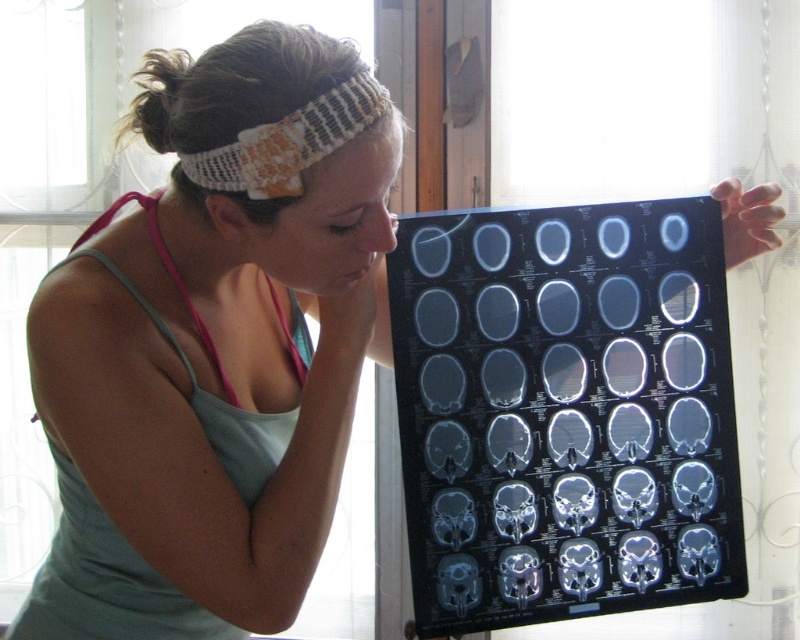
Question: Is white knitted headscarf at upper center to the right of white knitted headband at upper center from the viewer's perspective?

Choices:
 (A) no
 (B) yes

Answer: (A)

Question: Which of the following is the farthest from the observer?

Choices:
 (A) white knitted headscarf at upper center
 (B) white knitted headband at upper center

Answer: (B)

Question: Among these objects, which one is nearest to the camera?

Choices:
 (A) white knitted headscarf at upper center
 (B) white knitted headband at upper center

Answer: (A)

Question: Does white knitted headscarf at upper center have a smaller size compared to white knitted headband at upper center?

Choices:
 (A) no
 (B) yes

Answer: (A)

Question: Which object appears farthest from the camera in this image?

Choices:
 (A) white knitted headband at upper center
 (B) white knitted headscarf at upper center

Answer: (A)

Question: Is white knitted headscarf at upper center wider than white knitted headband at upper center?

Choices:
 (A) yes
 (B) no

Answer: (A)